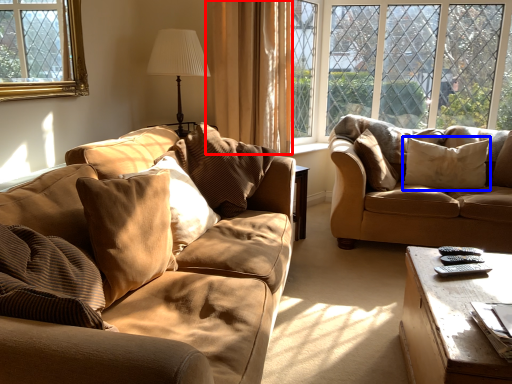
Question: Which of the following is the farthest to the observer, curtain (highlighted by a red box) or pillow (highlighted by a blue box)?

Choices:
 (A) curtain
 (B) pillow

Answer: (B)